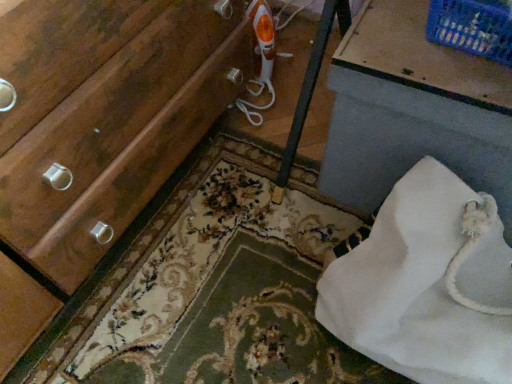
The width and height of the screenshot is (512, 384). In order to click on vacant space situated above floral carpet at lower center (from a real-world perspective) in this screenshot , I will do `click(237, 224)`.